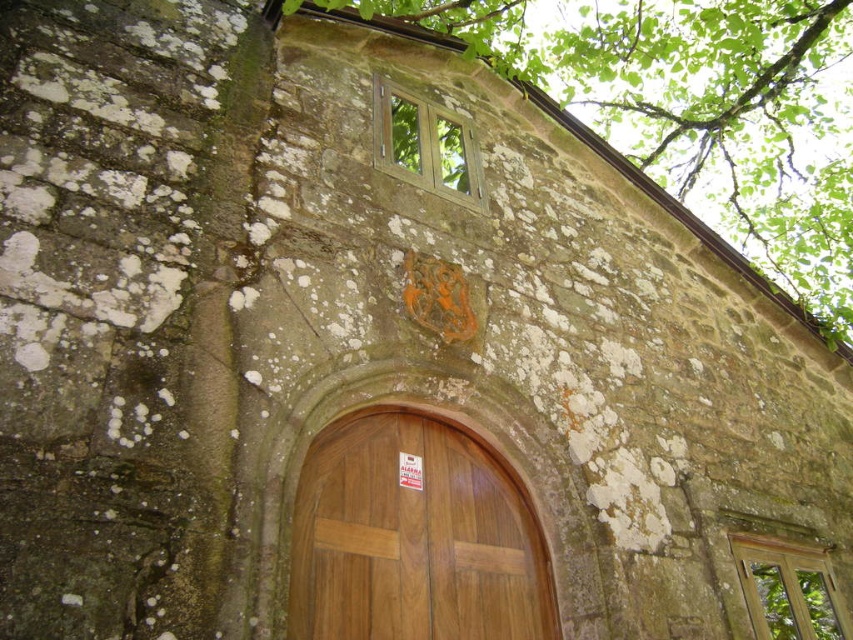
You are an architect analyzing the facade of this historic building. You notice the green leafy tree at upper center and the wooden door at center. Which object occupies a greater area in the image?

The green leafy tree at upper center is larger in size than the wooden door at center, so it occupies a greater area in the image.

You are standing in front of the wooden door at center and want to look up to see the green leafy tree at upper center. In which direction should you turn your head?

You should turn your head to the right because the green leafy tree at upper center is positioned on the right side of the wooden door at center.